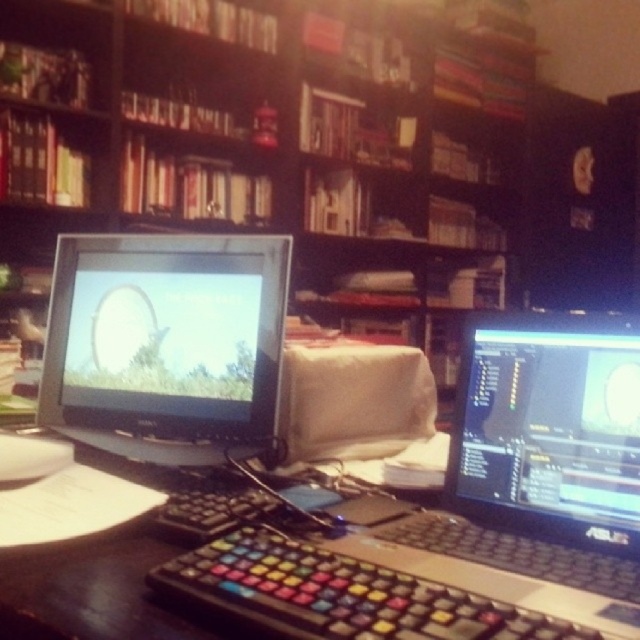
You are organizing your workspace and need to place a new item on the wooden bookshelf at upper center. Given its coordinates at point 0.230, 0.431, can you confirm its position relative to the desk?

The wooden bookshelf at upper center is located at point [275,147], which means it is positioned above and to the left of the desk in the workspace setup.

You are organizing a study area and want to place a new textbook on the desk. The textbook is 20 cm tall. Can you place it between the wooden bookshelf at upper center and the black glossy monitor at center without blocking either?

The wooden bookshelf at upper center is above the black glossy monitor at center, so placing the textbook between them vertically would not block either object as they are stacked vertically. However, since the textbook is only 20 cm tall, it can be placed on the desk between them horizontally without obstruction.